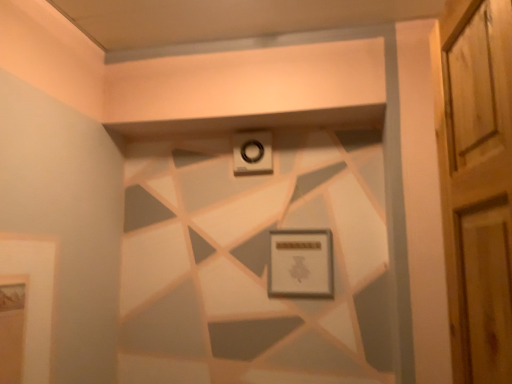
Question: Is matte white picture frame at center at the back of white plastic alarm at upper center?

Choices:
 (A) no
 (B) yes

Answer: (A)

Question: Is white plastic alarm at upper center further to the viewer compared to matte white picture frame at center?

Choices:
 (A) no
 (B) yes

Answer: (B)

Question: From the image's perspective, is white plastic alarm at upper center under matte white picture frame at center?

Choices:
 (A) yes
 (B) no

Answer: (B)

Question: Is matte white picture frame at center completely or partially inside white plastic alarm at upper center?

Choices:
 (A) yes
 (B) no

Answer: (B)

Question: Can you confirm if white plastic alarm at upper center is shorter than matte white picture frame at center?

Choices:
 (A) yes
 (B) no

Answer: (A)

Question: Can you confirm if white plastic alarm at upper center is positioned to the right of matte white picture frame at center?

Choices:
 (A) no
 (B) yes

Answer: (A)

Question: From the image's perspective, is matte white picture frame at center over white plastic alarm at upper center?

Choices:
 (A) no
 (B) yes

Answer: (A)

Question: Can you confirm if matte white picture frame at center is thinner than white plastic alarm at upper center?

Choices:
 (A) yes
 (B) no

Answer: (A)

Question: Does matte white picture frame at center have a lesser height compared to white plastic alarm at upper center?

Choices:
 (A) yes
 (B) no

Answer: (B)

Question: Is matte white picture frame at center further to camera compared to white plastic alarm at upper center?

Choices:
 (A) yes
 (B) no

Answer: (B)

Question: Is matte white picture frame at center turned away from white plastic alarm at upper center?

Choices:
 (A) yes
 (B) no

Answer: (B)

Question: Is matte white picture frame at center outside of white plastic alarm at upper center?

Choices:
 (A) no
 (B) yes

Answer: (B)

Question: Based on their positions, is white plastic alarm at upper center located to the left or right of matte white picture frame at center?

Choices:
 (A) right
 (B) left

Answer: (B)